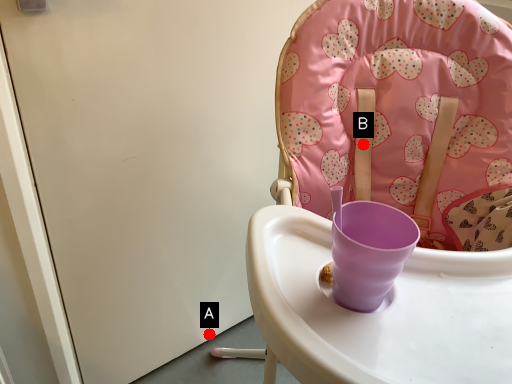
Question: Two points are circled on the image, labeled by A and B beside each circle. Which point is farther to the camera?

Choices:
 (A) A is further
 (B) B is further

Answer: (A)